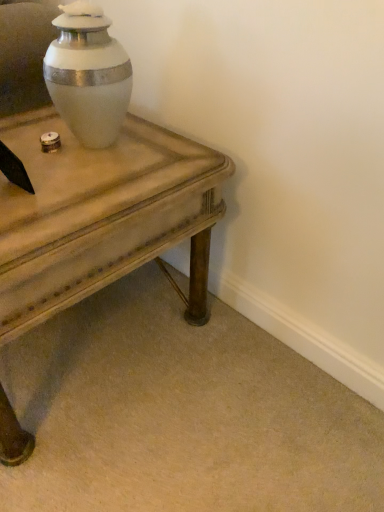
Question: Considering the relative sizes of wooden side table at center and white glossy urn at upper center in the image provided, is wooden side table at center taller than white glossy urn at upper center?

Choices:
 (A) no
 (B) yes

Answer: (B)

Question: Is the surface of wooden side table at center in direct contact with white glossy urn at upper center?

Choices:
 (A) no
 (B) yes

Answer: (A)

Question: Is white glossy urn at upper center completely or partially inside wooden side table at center?

Choices:
 (A) no
 (B) yes

Answer: (A)

Question: From the image's perspective, is wooden side table at center over white glossy urn at upper center?

Choices:
 (A) no
 (B) yes

Answer: (A)

Question: Is wooden side table at center smaller than white glossy urn at upper center?

Choices:
 (A) yes
 (B) no

Answer: (B)

Question: Is wooden side table at center oriented towards white glossy urn at upper center?

Choices:
 (A) yes
 (B) no

Answer: (B)

Question: Could you tell me if white glossy urn at upper center is facing wooden side table at center?

Choices:
 (A) yes
 (B) no

Answer: (B)

Question: Can you confirm if white glossy urn at upper center is smaller than wooden side table at center?

Choices:
 (A) yes
 (B) no

Answer: (A)

Question: Is white glossy urn at upper center far from wooden side table at center?

Choices:
 (A) no
 (B) yes

Answer: (A)

Question: From the image's perspective, is white glossy urn at upper center on top of wooden side table at center?

Choices:
 (A) yes
 (B) no

Answer: (A)

Question: Is wooden side table at center located within white glossy urn at upper center?

Choices:
 (A) no
 (B) yes

Answer: (A)

Question: Is white glossy urn at upper center oriented away from wooden side table at center?

Choices:
 (A) yes
 (B) no

Answer: (B)

Question: Is wooden side table at center bigger or smaller than white glossy urn at upper center?

Choices:
 (A) small
 (B) big

Answer: (B)